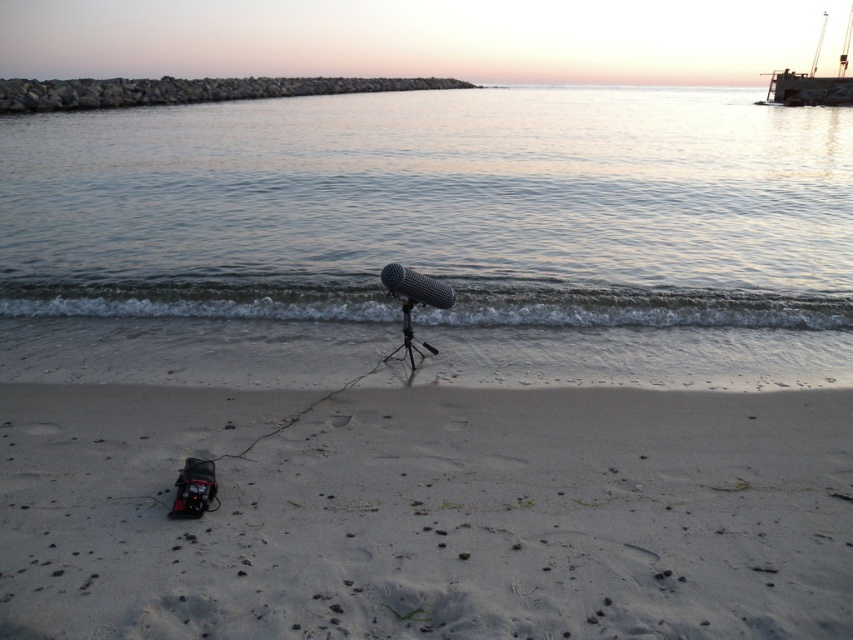
Question: Which point is farther to the camera?

Choices:
 (A) clear water at center
 (B) black matte tripod at center

Answer: (A)

Question: Is white sandy beach at lower center below black matte tripod at center?

Choices:
 (A) yes
 (B) no

Answer: (A)

Question: Is the position of clear water at center less distant than that of metallic gray boat at upper right?

Choices:
 (A) yes
 (B) no

Answer: (A)

Question: Is white sandy beach at lower center bigger than black matte tripod at center?

Choices:
 (A) yes
 (B) no

Answer: (A)

Question: Among these objects, which one is nearest to the camera?

Choices:
 (A) metallic gray boat at upper right
 (B) white sandy beach at lower center
 (C) black matte tripod at center
 (D) clear water at center

Answer: (B)

Question: Estimate the real-world distances between objects in this image. Which object is closer to the black matte tripod at center?

Choices:
 (A) clear water at center
 (B) white sandy beach at lower center
 (C) metallic gray boat at upper right

Answer: (B)